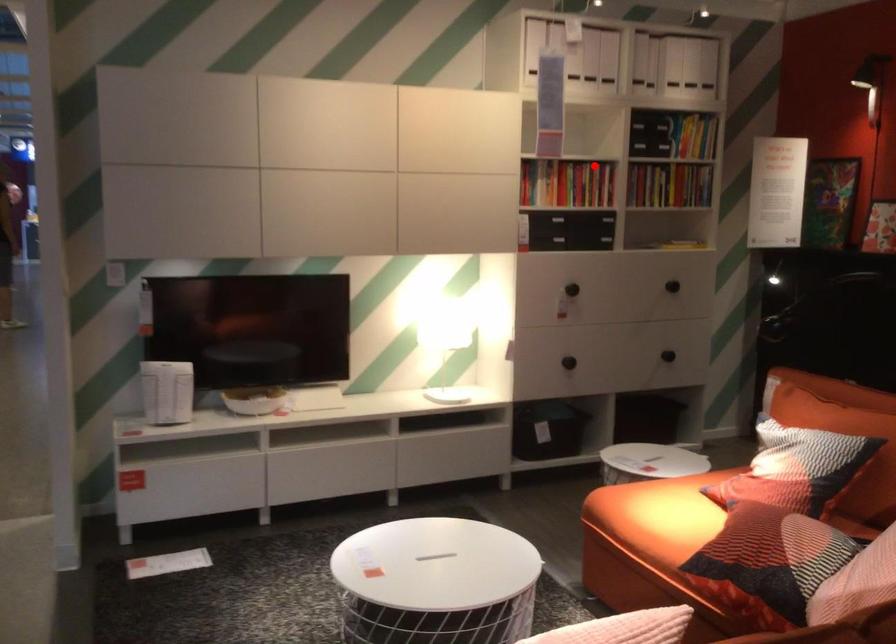
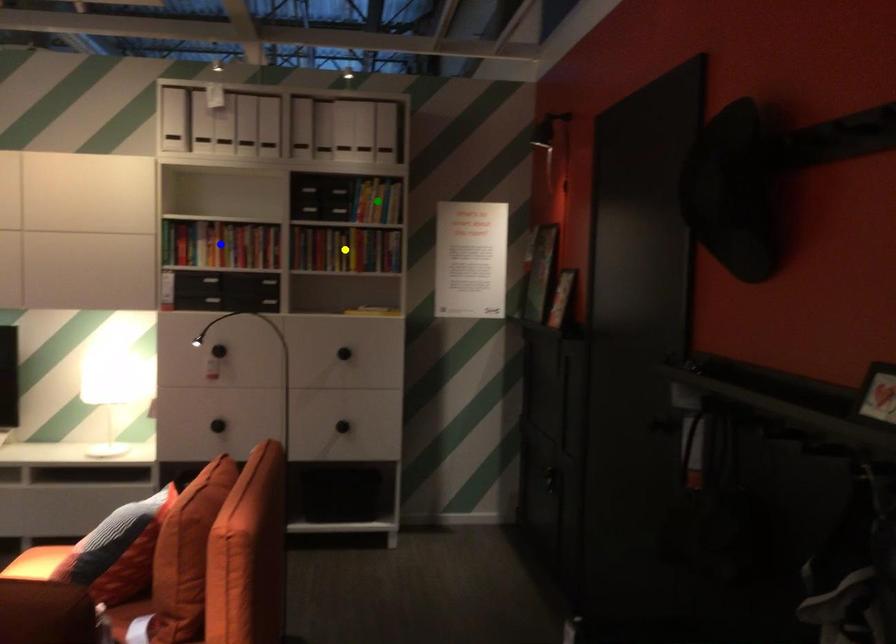
Question: I am providing you with two images of the same scene from different viewpoints. A red point is marked on the first image. You are given multiple points on the second image. Which mark in image 2 goes with the point in image 1?

Choices:
 (A) green point
 (B) yellow point
 (C) blue point

Answer: (C)